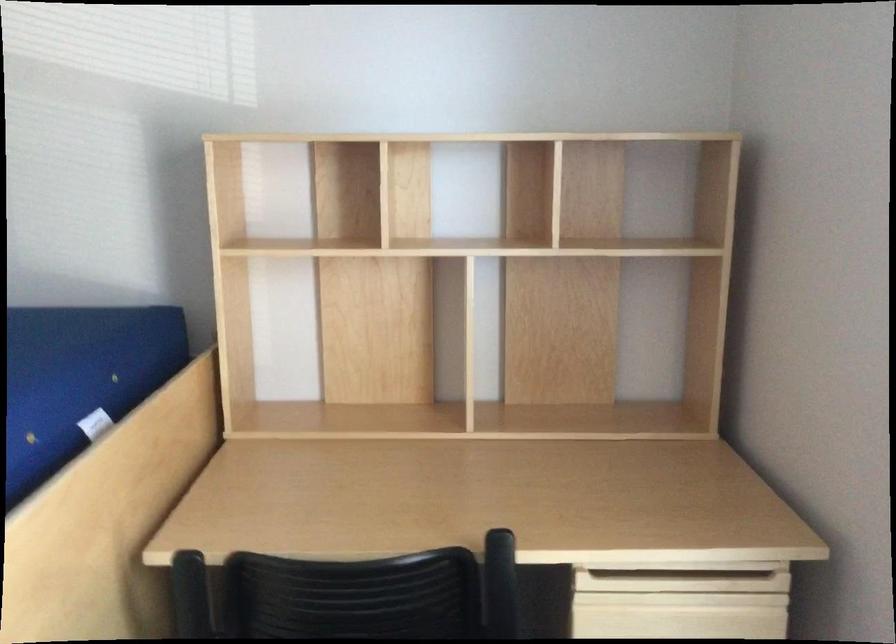
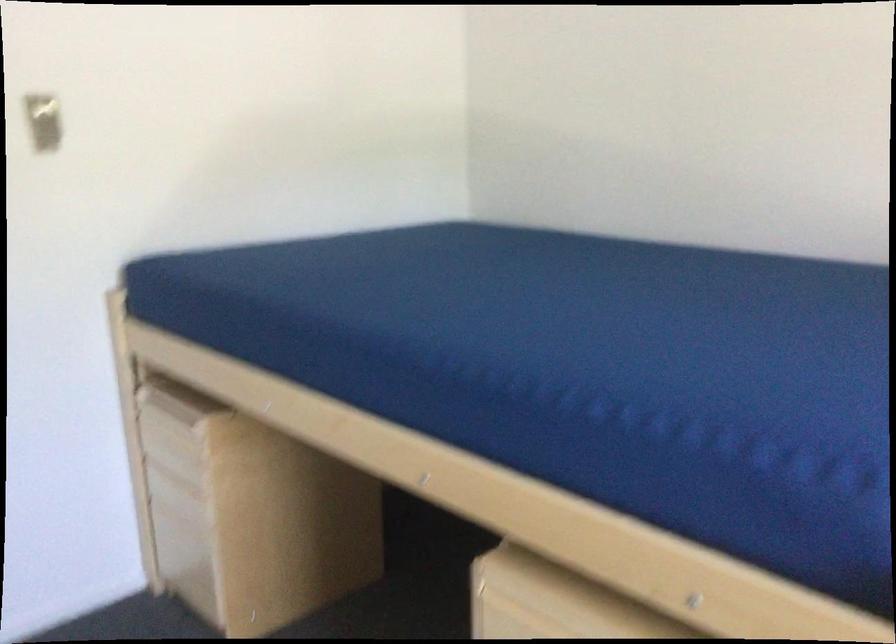
Question: The images are taken continuously from a first-person perspective. In which direction is your viewpoint rotating?

Choices:
 (A) Left
 (B) Right
 (C) Up
 (D) Down

Answer: (A)